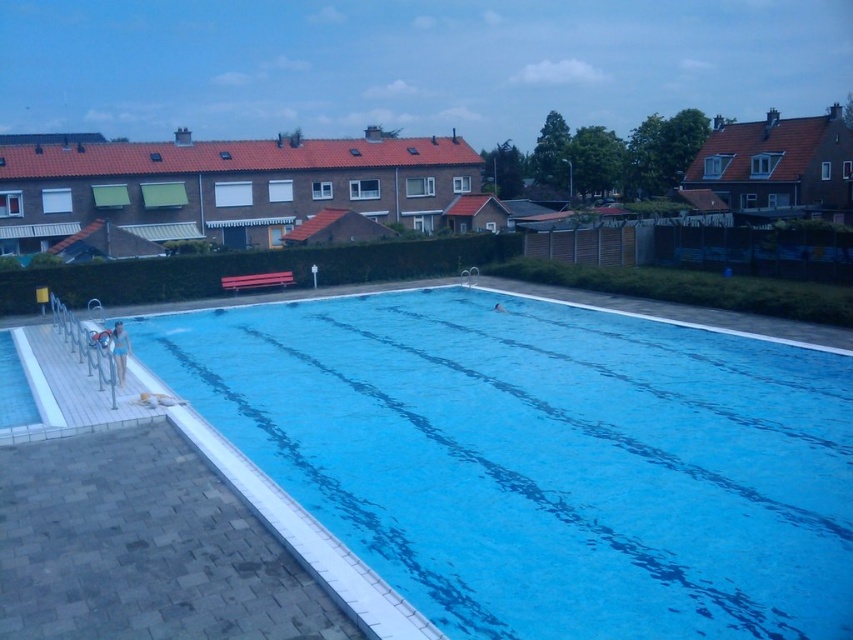
You are a lifeguard standing at the edge of the pool. You notice the blue smooth water at center and the matte blue swimsuit at lower left. Which object is positioned lower in the image?

The blue smooth water at center is positioned below the matte blue swimsuit at lower left, so the blue smooth water at center is lower in the image.

In the scene shown: You are designing a safety plan for the pool area and need to ensure that the blue smooth water at center is accessible to someone using the matte blue swimsuit at lower left. Considering the width of both, will the swimsuit fit comfortably in the water area?

The blue smooth water at center has a larger width than the matte blue swimsuit at lower left, so the swimsuit will fit comfortably within the water area.